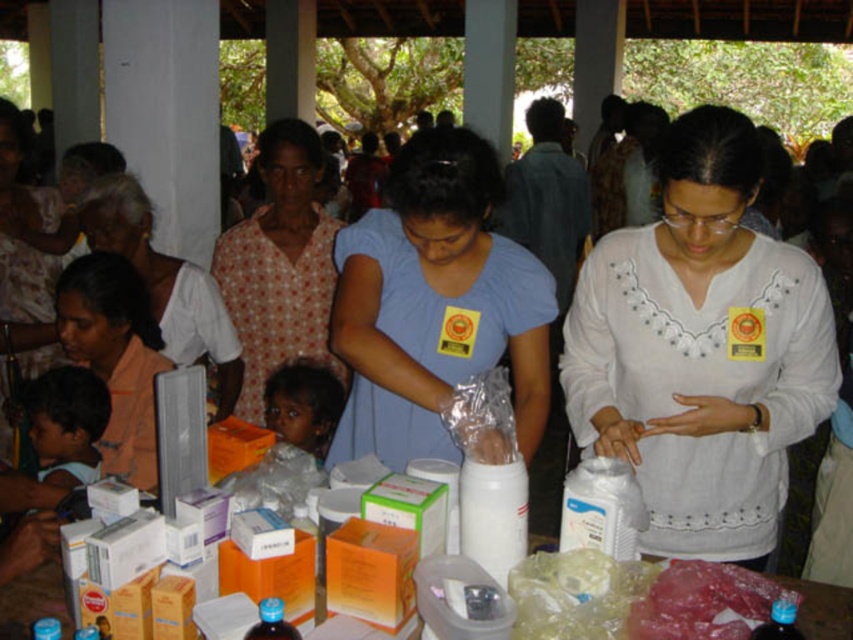
You are an aid worker at the event. You need to place a new item on the table. The item is the same size as the white plastic container at center. Where should you place it to ensure it doesn not block the matte blue shirt at center?

Since the matte blue shirt at center is larger than the white plastic container at center, placing the new item near the edge of the table away from the matte blue shirt at center would prevent blocking it.

You are a volunteer at a community health event and need to hand a medical kit to the dark skin baby at center. The floral fabric dress at center is blocking your path. Which direction should you move to avoid the dress?

The floral fabric dress at center is on the left side of the dark skin baby at center, so you should move to the right to avoid the dress and reach the baby.

You are a volunteer at the health event and need to hand out supplies from the table. You notice the white cotton shirt at center and the smooth skin child at lower left. Which individual is taller?

The white cotton shirt at center is taller than the smooth skin child at lower left.